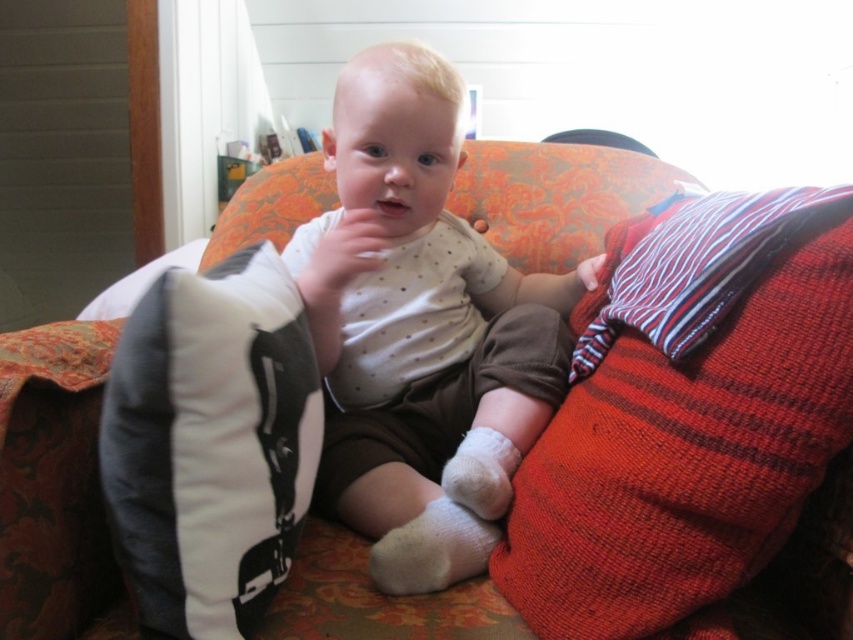
Question: From the image, what is the correct spatial relationship of red knitted blanket at right in relation to white soft baby at center?

Choices:
 (A) right
 (B) left

Answer: (A)

Question: Which object is closer to the camera taking this photo?

Choices:
 (A) red knitted blanket at right
 (B) white fabric pillow at left
 (C) white soft baby at center

Answer: (B)

Question: Which of these objects is positioned farthest from the red knitted blanket at right?

Choices:
 (A) white fabric pillow at left
 (B) white soft baby at center

Answer: (A)

Question: Can you confirm if red knitted blanket at right is smaller than white soft baby at center?

Choices:
 (A) yes
 (B) no

Answer: (A)

Question: Which object appears closest to the camera in this image?

Choices:
 (A) red knitted blanket at right
 (B) white soft baby at center

Answer: (A)

Question: Can you confirm if red knitted blanket at right is wider than white fabric pillow at left?

Choices:
 (A) yes
 (B) no

Answer: (A)